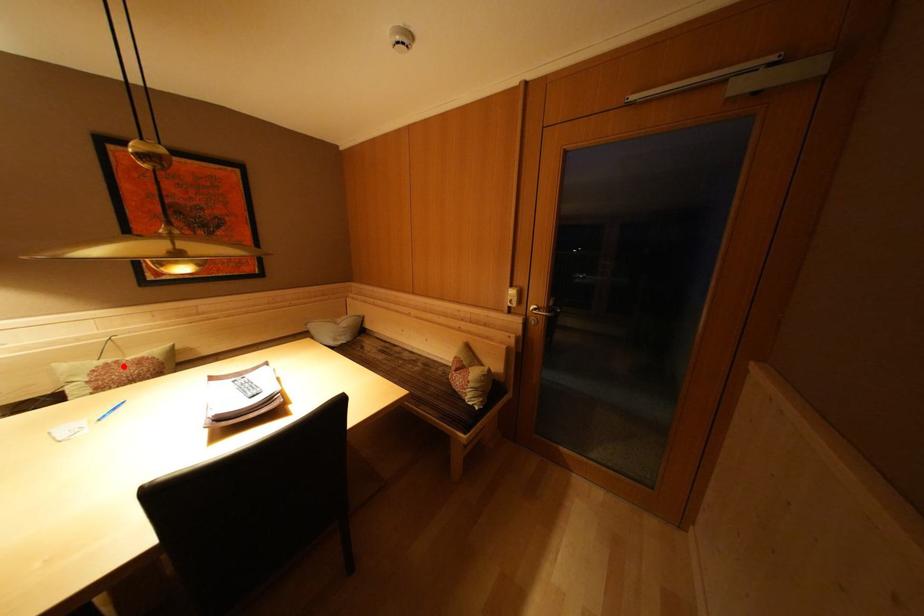
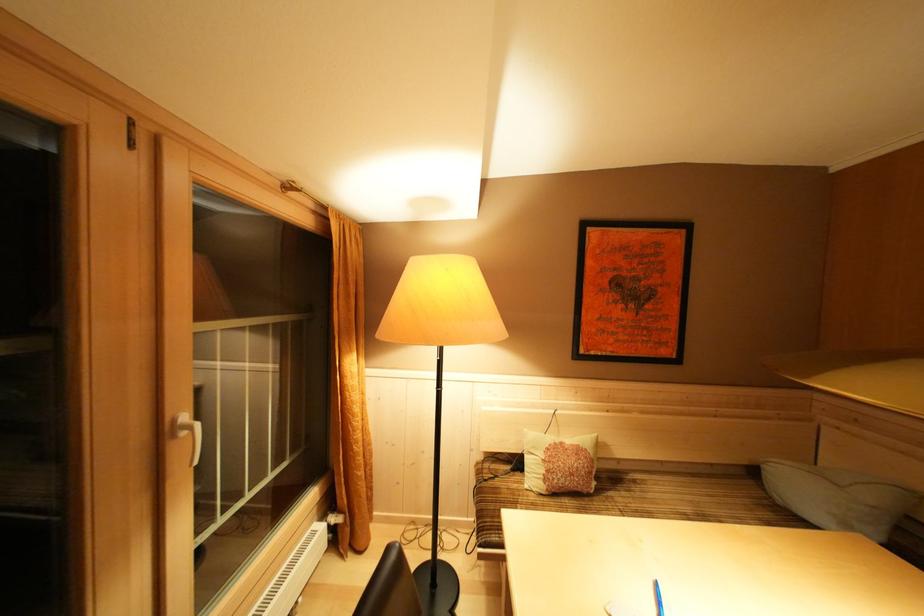
Question: I am providing you with two images of the same scene from different viewpoints. Given a red point in image1, look at the same physical point in image2. Is it:

Choices:
 (A) Closer to the viewpoint
 (B) Farther from the viewpoint

Answer: (B)